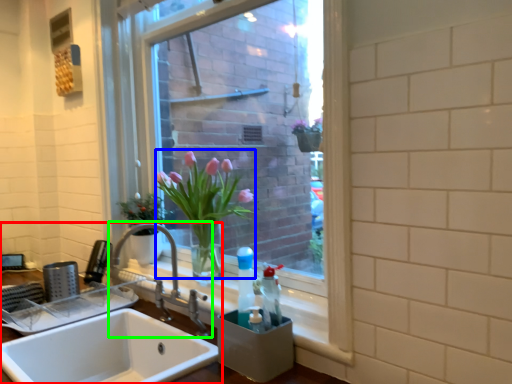
Question: Based on their relative distances, which object is farther from sink (highlighted by a red box)? Choose from floral arrangement (highlighted by a blue box) and tap (highlighted by a green box).

Choices:
 (A) floral arrangement
 (B) tap

Answer: (A)